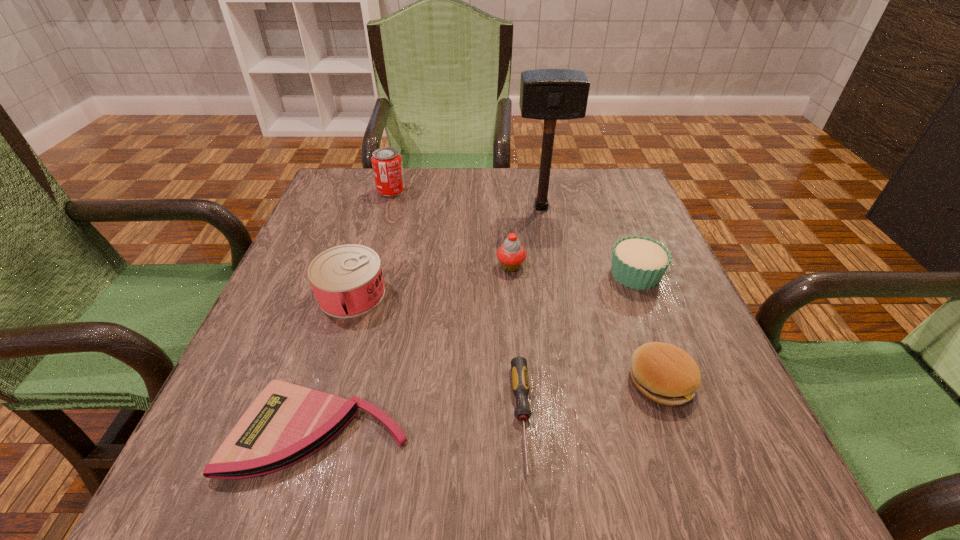
Find the location of `vacant area at the far right corner of the desktop`. vacant area at the far right corner of the desktop is located at coordinates (623, 172).

I want to click on vacant space in between the screwdriver and the taller cupcake, so click(x=516, y=342).

This screenshot has height=540, width=960. I want to click on free space between the wristlet and the patty, so click(490, 406).

The width and height of the screenshot is (960, 540). In order to click on vacant area between the mallet and the screwdriver in this screenshot , I will do `click(532, 312)`.

The height and width of the screenshot is (540, 960). In order to click on free space between the shorter cupcake and the taller cupcake in this screenshot , I will do `click(573, 270)`.

At what (x,y) coordinates should I click in order to perform the action: click on free spot between the screwdriver and the farthest object. Please return your answer as a coordinate pair (x, y). Looking at the image, I should click on (457, 304).

This screenshot has width=960, height=540. Identify the location of free space between the shorter can and the patty. (506, 338).

At what (x,y) coordinates should I click in order to perform the action: click on unoccupied area between the farthest object and the shorter can. Please return your answer as a coordinate pair (x, y). The width and height of the screenshot is (960, 540). Looking at the image, I should click on (372, 242).

At what (x,y) coordinates should I click in order to perform the action: click on vacant area between the nearer can and the patty. Please return your answer as a coordinate pair (x, y). Looking at the image, I should click on (506, 338).

You are a GUI agent. You are given a task and a screenshot of the screen. Output one action in this format:
    pyautogui.click(x=<x>, y=<y>)
    Task: Click on the free space that is in between the wristlet and the shorter cupcake
    
    Given the screenshot: What is the action you would take?
    pyautogui.click(x=477, y=352)